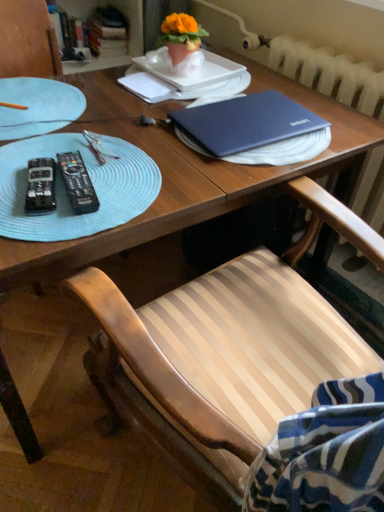
Image resolution: width=384 pixels, height=512 pixels. Identify the location of free spot in front of black plastic remote control at left, the 2th remote control when ordered from right to left. (34, 227).